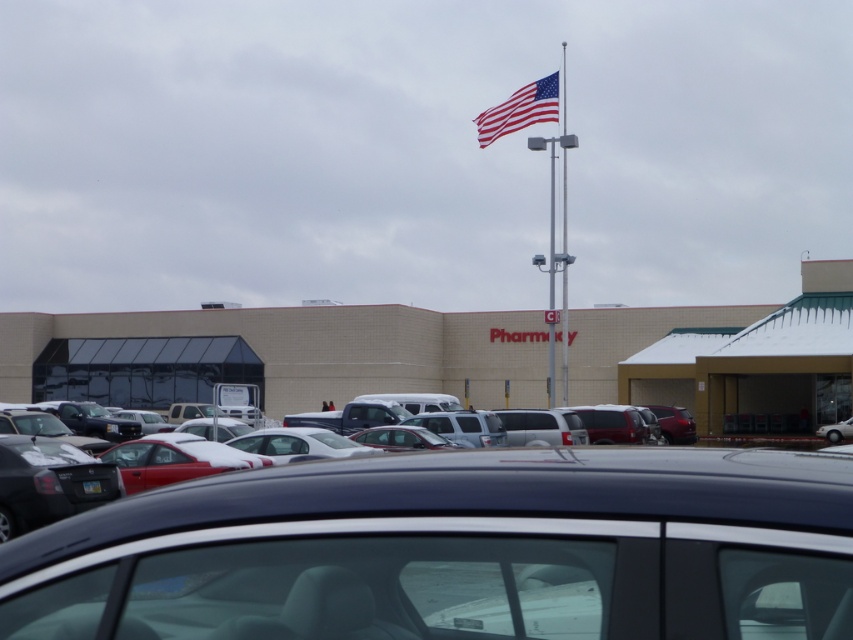
Does beige brick building at center appear over american flag at upper center?

Incorrect, beige brick building at center is not positioned above american flag at upper center.

Describe the element at coordinates (281, 353) in the screenshot. This screenshot has width=853, height=640. I see `beige brick building at center` at that location.

The image size is (853, 640). I want to click on beige brick building at center, so click(281, 353).

Can you confirm if shiny black sedan at center is wider than american flag at upper center?

In fact, shiny black sedan at center might be narrower than american flag at upper center.

What do you see at coordinates (456, 550) in the screenshot?
I see `shiny black sedan at center` at bounding box center [456, 550].

Which is in front, point (444, 560) or point (531, 113)?

Point (444, 560) is more forward.

Where is `shiny black sedan at center`? The height and width of the screenshot is (640, 853). shiny black sedan at center is located at coordinates (456, 550).

Is beige brick building at center below metallic silver flag pole at upper center?

Correct, beige brick building at center is located below metallic silver flag pole at upper center.

Between point (68, 365) and point (561, 145), which one is positioned behind?

Point (68, 365)

You are a GUI agent. You are given a task and a screenshot of the screen. Output one action in this format:
    pyautogui.click(x=<x>, y=<y>)
    Task: Click on the beige brick building at center
    Image resolution: width=853 pixels, height=640 pixels.
    Given the screenshot: What is the action you would take?
    pyautogui.click(x=281, y=353)

I want to click on beige brick building at center, so click(281, 353).